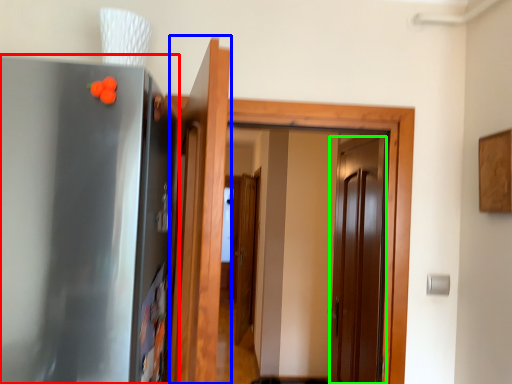
Question: Which object is the closest to the appliance (highlighted by a red box)? Choose among these: door (highlighted by a blue box) or door (highlighted by a green box).

Choices:
 (A) door
 (B) door

Answer: (A)